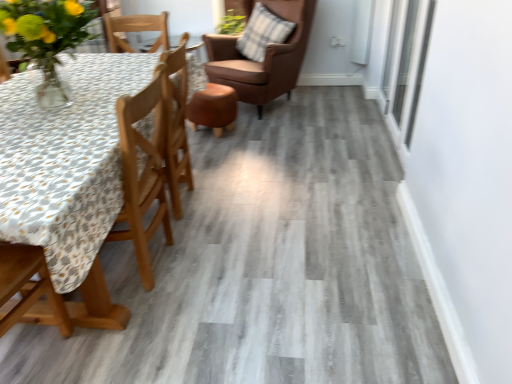
Measure the distance between translucent glass vase at upper left and camera.

5.46 feet.

This screenshot has width=512, height=384. Describe the element at coordinates (262, 33) in the screenshot. I see `plaid fabric pillow at upper right` at that location.

You are a GUI agent. You are given a task and a screenshot of the screen. Output one action in this format:
    pyautogui.click(x=<x>, y=<y>)
    Task: Click on the wooden chair at left, which appears as the second chair when viewed from the right
    
    Given the screenshot: What is the action you would take?
    pyautogui.click(x=53, y=295)

Where is `brown leather chair at upper center, positioned as the 1th chair in top-to-bottom order`? The height and width of the screenshot is (384, 512). brown leather chair at upper center, positioned as the 1th chair in top-to-bottom order is located at coordinates (264, 57).

What do you see at coordinates (264, 57) in the screenshot?
I see `brown leather chair at upper center, which is the 1th chair in right-to-left order` at bounding box center [264, 57].

At what (x,y) coordinates should I click in order to perform the action: click on transparent glass window at upper right. Please return your answer as a coordinate pair (x, y). The image size is (512, 384). Looking at the image, I should click on [406, 65].

Which object is further away from the camera taking this photo, brown leather chair at upper center, arranged as the first chair when viewed from the back, or plaid fabric pillow at upper right?

plaid fabric pillow at upper right is behind.

In terms of width, does brown leather chair at upper center, positioned as the 1th chair in top-to-bottom order, look wider or thinner when compared to plaid fabric pillow at upper right?

Clearly, brown leather chair at upper center, positioned as the 1th chair in top-to-bottom order, has more width compared to plaid fabric pillow at upper right.

Can you tell me how much brown leather chair at upper center, which is the 1th chair in right-to-left order, and plaid fabric pillow at upper right differ in facing direction?

The angle between the facing direction of brown leather chair at upper center, which is the 1th chair in right-to-left order, and the facing direction of plaid fabric pillow at upper right is 5.38 degrees.

Between transparent glass window at upper right and translucent glass vase at upper left, which one is positioned behind?

transparent glass window at upper right is further from the camera.

From a real-world perspective, between transparent glass window at upper right and translucent glass vase at upper left, who is vertically lower?

transparent glass window at upper right, from a real-world perspective.

Does transparent glass window at upper right appear on the left side of translucent glass vase at upper left?

No, transparent glass window at upper right is not to the left of translucent glass vase at upper left.

Considering the sizes of transparent glass window at upper right and translucent glass vase at upper left in the image, is transparent glass window at upper right taller or shorter than translucent glass vase at upper left?

transparent glass window at upper right is taller than translucent glass vase at upper left.

Is translucent glass vase at upper left in contact with plaid fabric pillow at upper right?

translucent glass vase at upper left and plaid fabric pillow at upper right are not in contact.

Considering the sizes of objects translucent glass vase at upper left and plaid fabric pillow at upper right in the image provided, who is thinner, translucent glass vase at upper left or plaid fabric pillow at upper right?

Thinner between the two is plaid fabric pillow at upper right.

From a real-world perspective, is translucent glass vase at upper left under plaid fabric pillow at upper right?

No.

Would you say wooden chair at left, acting as the 1th chair starting from the front, is outside transparent glass window at upper right?

wooden chair at left, acting as the 1th chair starting from the front, lies outside transparent glass window at upper right's area.

Is wooden chair at left, which ranks as the 2th chair in back-to-front order, next to transparent glass window at upper right and touching it?

No, wooden chair at left, which ranks as the 2th chair in back-to-front order, is not touching transparent glass window at upper right.

From the image's perspective, is wooden chair at left, which appears as the second chair when viewed from the right, below transparent glass window at upper right?

Indeed, from the image's perspective, wooden chair at left, which appears as the second chair when viewed from the right, is shown beneath transparent glass window at upper right.

Is wooden chair at left, which ranks as the 2th chair in back-to-front order, thinner than transparent glass window at upper right?

No, wooden chair at left, which ranks as the 2th chair in back-to-front order, is not thinner than transparent glass window at upper right.

From the image's perspective, is plaid fabric pillow at upper right positioned above or below transparent glass window at upper right?

From the image's perspective, plaid fabric pillow at upper right appears above transparent glass window at upper right.

Is plaid fabric pillow at upper right positioned beyond the bounds of transparent glass window at upper right?

Absolutely, plaid fabric pillow at upper right is external to transparent glass window at upper right.

Which object is thinner, plaid fabric pillow at upper right or transparent glass window at upper right?

transparent glass window at upper right.

Is plaid fabric pillow at upper right smaller than transparent glass window at upper right?

No.

Is transparent glass window at upper right touching wooden chair at left, positioned as the second chair in top-to-bottom order?

No, transparent glass window at upper right is not making contact with wooden chair at left, positioned as the second chair in top-to-bottom order.

Which is behind, point (401, 48) or point (5, 330)?

Point (401, 48)

Is transparent glass window at upper right smaller than wooden chair at left, positioned as the second chair in top-to-bottom order?

Indeed, transparent glass window at upper right has a smaller size compared to wooden chair at left, positioned as the second chair in top-to-bottom order.

Is transparent glass window at upper right to the right of wooden chair at left, which ranks as the 2th chair in back-to-front order, from the viewer's perspective?

Correct, you'll find transparent glass window at upper right to the right of wooden chair at left, which ranks as the 2th chair in back-to-front order.

Is wooden chair at left, the 1th chair ordered from the bottom, turned away from plaid fabric pillow at upper right?

No, wooden chair at left, the 1th chair ordered from the bottom,'s orientation is not away from plaid fabric pillow at upper right.

Find the location of a particular element. pillow located above the wooden chair at left, positioned as the second chair in top-to-bottom order (from a real-world perspective) is located at coordinates (262, 33).

Considering the relative sizes of wooden chair at left, which ranks as the 2th chair in back-to-front order, and plaid fabric pillow at upper right in the image provided, is wooden chair at left, which ranks as the 2th chair in back-to-front order, taller than plaid fabric pillow at upper right?

Yes.

In the image, is wooden chair at left, acting as the 1th chair starting from the front, positioned in front of or behind plaid fabric pillow at upper right?

wooden chair at left, acting as the 1th chair starting from the front, is positioned closer to the viewer than plaid fabric pillow at upper right.

This screenshot has width=512, height=384. What are the coordinates of `pillow on the right of brown leather chair at upper center, the second chair positioned from the bottom` in the screenshot? It's located at (262, 33).

Where is `floral arrangement in front of the transparent glass window at upper right`? The image size is (512, 384). floral arrangement in front of the transparent glass window at upper right is located at coordinates (46, 38).

Based on their spatial positions, is plaid fabric pillow at upper right or brown leather chair at upper center, which ranks as the second chair in front-to-back order, further from translucent glass vase at upper left?

The object further to translucent glass vase at upper left is plaid fabric pillow at upper right.

When comparing their distances from brown leather chair at upper center, which is the 1th chair in right-to-left order, does wooden chair at left, positioned as the second chair in top-to-bottom order, or plaid fabric pillow at upper right seem further?

→ wooden chair at left, positioned as the second chair in top-to-bottom order, is positioned further to the anchor brown leather chair at upper center, which is the 1th chair in right-to-left order.

Based on their spatial positions, is transparent glass window at upper right or brown leather chair at upper center, marked as the second chair in a left-to-right arrangement, further from plaid fabric pillow at upper right?

transparent glass window at upper right lies further to plaid fabric pillow at upper right than the other object.

Estimate the real-world distances between objects in this image. Which object is further from transparent glass window at upper right, brown leather chair at upper center, arranged as the first chair when viewed from the back, or plaid fabric pillow at upper right?

The object further to transparent glass window at upper right is plaid fabric pillow at upper right.

Based on their spatial positions, is brown leather chair at upper center, positioned as the 1th chair in top-to-bottom order, or wooden chair at left, acting as the 1th chair starting from the front, further from transparent glass window at upper right?

wooden chair at left, acting as the 1th chair starting from the front, is positioned further to the anchor transparent glass window at upper right.

From the image, which object appears to be nearer to transparent glass window at upper right, plaid fabric pillow at upper right or translucent glass vase at upper left?

The object closer to transparent glass window at upper right is plaid fabric pillow at upper right.

Based on their spatial positions, is wooden chair at left, which is the first chair in left-to-right order, or transparent glass window at upper right further from brown leather chair at upper center, positioned as the 1th chair in top-to-bottom order?

wooden chair at left, which is the first chair in left-to-right order, lies further to brown leather chair at upper center, positioned as the 1th chair in top-to-bottom order, than the other object.

Estimate the real-world distances between objects in this image. Which object is closer to plaid fabric pillow at upper right, wooden chair at left, which ranks as the 2th chair in back-to-front order, or brown leather chair at upper center, positioned as the 1th chair in top-to-bottom order?

brown leather chair at upper center, positioned as the 1th chair in top-to-bottom order, is closer to plaid fabric pillow at upper right.

At what (x,y) coordinates should I click in order to perform the action: click on chair between wooden chair at left, which appears as the second chair when viewed from the right, and plaid fabric pillow at upper right in the front-back direction. Please return your answer as a coordinate pair (x, y). The height and width of the screenshot is (384, 512). Looking at the image, I should click on (264, 57).

You are a GUI agent. You are given a task and a screenshot of the screen. Output one action in this format:
    pyautogui.click(x=<x>, y=<y>)
    Task: Click on the pillow located between translucent glass vase at upper left and transparent glass window at upper right in the left-right direction
    
    Given the screenshot: What is the action you would take?
    pyautogui.click(x=262, y=33)

Image resolution: width=512 pixels, height=384 pixels. In order to click on floral arrangement between wooden chair at left, which ranks as the 2th chair in back-to-front order, and brown leather chair at upper center, the second chair positioned from the bottom, along the z-axis in this screenshot , I will do `click(46, 38)`.

Find the location of `window located between wooden chair at left, acting as the 1th chair starting from the front, and plaid fabric pillow at upper right in the depth direction`. window located between wooden chair at left, acting as the 1th chair starting from the front, and plaid fabric pillow at upper right in the depth direction is located at coordinates (406, 65).